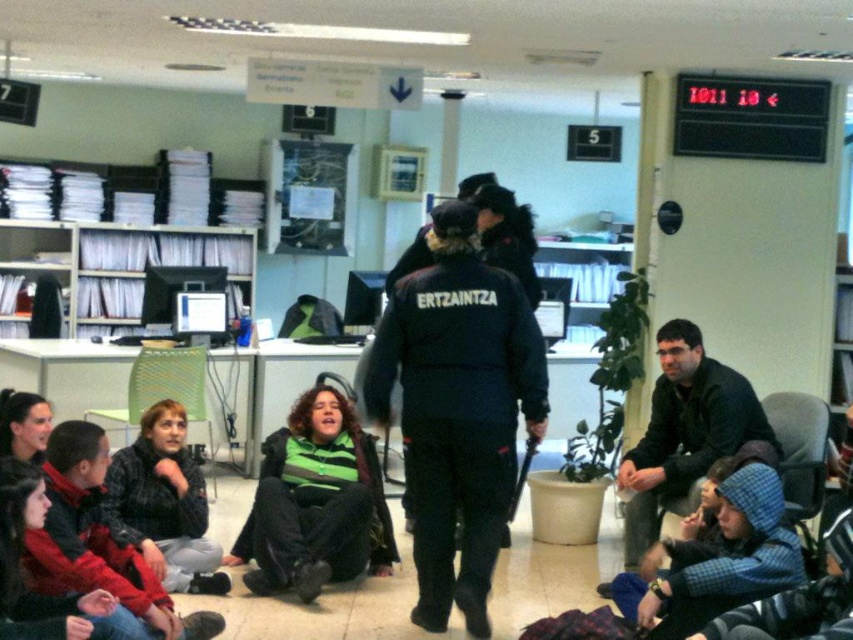
Is dark gray jacket at lower left bigger than dark blue jacket at center?

Actually, dark gray jacket at lower left might be smaller than dark blue jacket at center.

Which is more to the left, dark gray jacket at lower left or dark blue jacket at center?

dark gray jacket at lower left is more to the left.

In the scene shown: Who is more forward, (111, 589) or (668, 493)?

Point (111, 589) is in front.

The height and width of the screenshot is (640, 853). I want to click on dark gray jacket at lower left, so 99,544.

Can you confirm if green striped sweater at center is positioned to the left of dark blue jacket at center?

Yes, green striped sweater at center is to the left of dark blue jacket at center.

Is green striped sweater at center closer to the viewer compared to dark blue jacket at center?

Yes, it is in front of dark blue jacket at center.

Is point (351, 561) more distant than point (685, 460)?

No, (351, 561) is in front of (685, 460).

Where is `green striped sweater at center`? This screenshot has width=853, height=640. green striped sweater at center is located at coordinates (316, 502).

Does point (421, 305) lie in front of point (157, 625)?

No, (421, 305) is further to viewer.

Is black uniform at center closer to camera compared to dark gray jacket at lower left?

No, it is not.

Does point (508, 310) come closer to viewer compared to point (178, 625)?

No, it is not.

Locate an element on the screen. The height and width of the screenshot is (640, 853). black uniform at center is located at coordinates (457, 410).